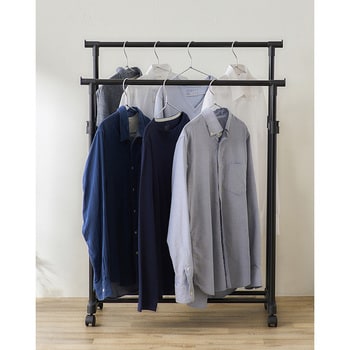
This screenshot has width=350, height=350. Find the location of `hanger`. hanger is located at coordinates (127, 106), (166, 104), (214, 102), (236, 65), (190, 67), (157, 66), (127, 67).